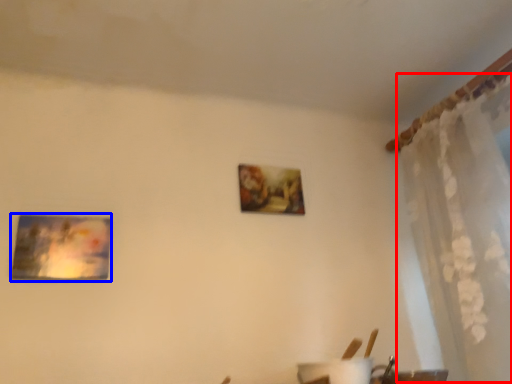
Question: Among these objects, which one is nearest to the camera, curtain (highlighted by a red box) or picture frame (highlighted by a blue box)?

Choices:
 (A) curtain
 (B) picture frame

Answer: (A)